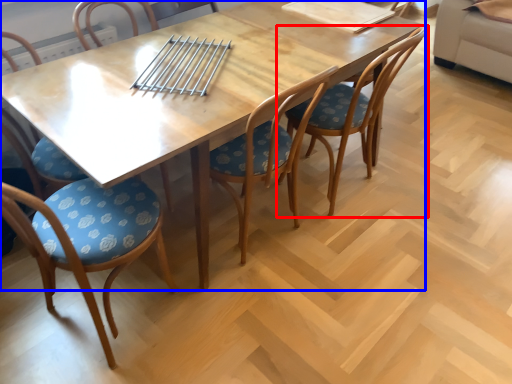
Question: Which of the following is the closest to the observer, chair (highlighted by a red box) or table (highlighted by a blue box)?

Choices:
 (A) chair
 (B) table

Answer: (B)